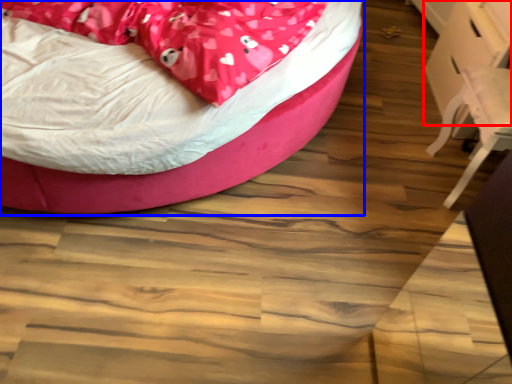
Question: Which object is closer to the camera taking this photo, table (highlighted by a red box) or bed (highlighted by a blue box)?

Choices:
 (A) table
 (B) bed

Answer: (B)